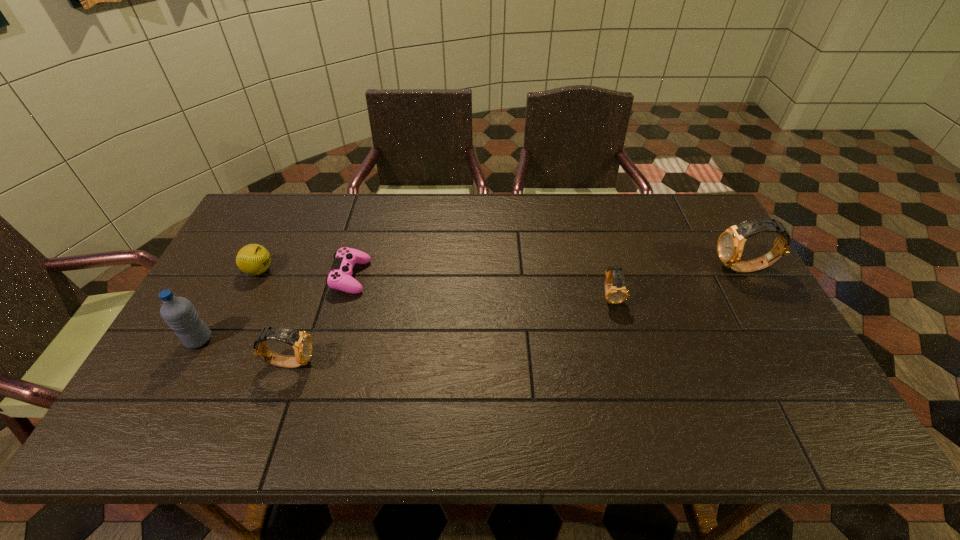
Locate an element on the screen. vacant space that's between the shortest object and the third tallest object is located at coordinates (321, 319).

Where is `free space between the leftmost watch and the water bottle`? free space between the leftmost watch and the water bottle is located at coordinates (245, 351).

Identify the location of vacant area that lies between the shortest object and the water bottle. (275, 308).

Locate an element on the screen. This screenshot has width=960, height=540. free spot between the fifth object from left to right and the water bottle is located at coordinates (405, 318).

At what (x,y) coordinates should I click in order to perform the action: click on unoccupied area between the control and the leftmost watch. Please return your answer as a coordinate pair (x, y). This screenshot has width=960, height=540. Looking at the image, I should click on (321, 319).

The image size is (960, 540). In order to click on empty location between the water bottle and the second farthest watch in this screenshot , I will do `click(405, 318)`.

I want to click on vacant space that's between the third tallest object and the farthest watch, so click(516, 315).

The height and width of the screenshot is (540, 960). Identify the location of object that is the third closest to the water bottle. (339, 278).

The height and width of the screenshot is (540, 960). I want to click on the fourth closest object to the water bottle, so click(616, 293).

Identify the location of watch that is the closest one to the shortest watch. This screenshot has height=540, width=960. (730, 245).